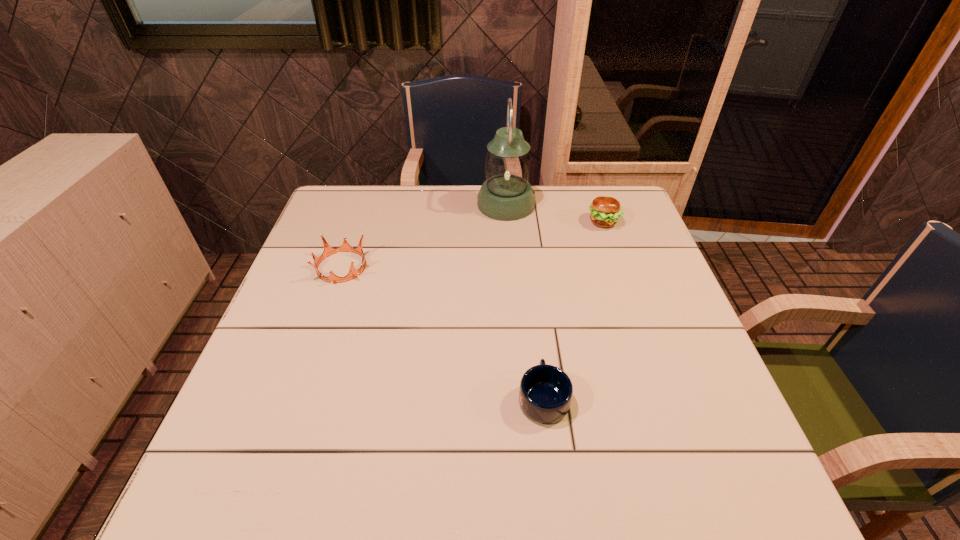
Identify the location of free spot between the hamburger and the crown. The height and width of the screenshot is (540, 960). (472, 244).

Locate an element on the screen. empty space that is in between the tallest object and the hamburger is located at coordinates (555, 213).

This screenshot has height=540, width=960. Find the location of `blank region between the nearest object and the second tallest object`. blank region between the nearest object and the second tallest object is located at coordinates (573, 309).

At what (x,y) coordinates should I click in order to perform the action: click on object that is the third closest to the tallest object. Please return your answer as a coordinate pair (x, y). This screenshot has width=960, height=540. Looking at the image, I should click on (545, 393).

This screenshot has height=540, width=960. Find the location of `object that ranks as the closest to the lantern`. object that ranks as the closest to the lantern is located at coordinates pos(605,211).

At what (x,y) coordinates should I click in order to perform the action: click on vacant space that satisfies the following two spatial constraints: 1. with the handle on the side of the second tallest object; 2. on the left side of the nearest object. Please return your answer as a coordinate pair (x, y). This screenshot has width=960, height=540. Looking at the image, I should click on (522, 222).